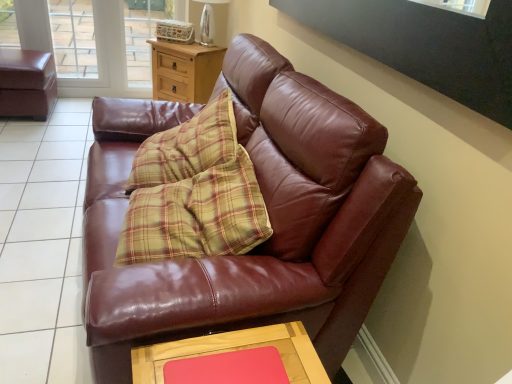
Identify the location of empty space that is ontop of rubberized pink mat at lower center. Image resolution: width=512 pixels, height=384 pixels. (233, 365).